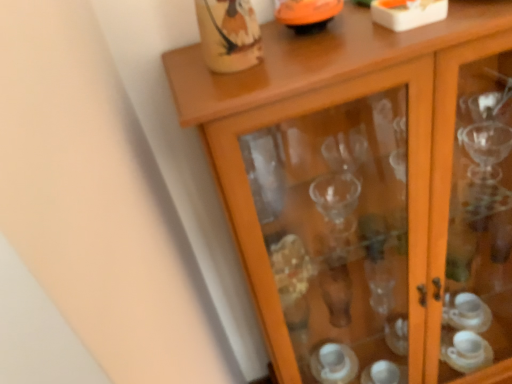
Question: Is point (303, 19) closer or farther from the camera than point (474, 152)?

Choices:
 (A) closer
 (B) farther

Answer: (A)

Question: Choose the correct answer: Is orange glossy bowl at upper center inside transparent glass cabinet at upper center or outside it?

Choices:
 (A) outside
 (B) inside

Answer: (A)

Question: Based on their positions, is orange glossy bowl at upper center located to the left or right of transparent glass cabinet at upper center?

Choices:
 (A) left
 (B) right

Answer: (A)

Question: Which is correct: transparent glass cabinet at upper center is inside orange glossy bowl at upper center, or outside of it?

Choices:
 (A) outside
 (B) inside

Answer: (A)

Question: From a real-world perspective, is transparent glass cabinet at upper center positioned above or below orange glossy bowl at upper center?

Choices:
 (A) below
 (B) above

Answer: (A)

Question: Considering the positions of transparent glass cabinet at upper center and orange glossy bowl at upper center in the image, is transparent glass cabinet at upper center taller or shorter than orange glossy bowl at upper center?

Choices:
 (A) tall
 (B) short

Answer: (A)

Question: Does point (418, 183) appear closer or farther from the camera than point (332, 3)?

Choices:
 (A) closer
 (B) farther

Answer: (B)